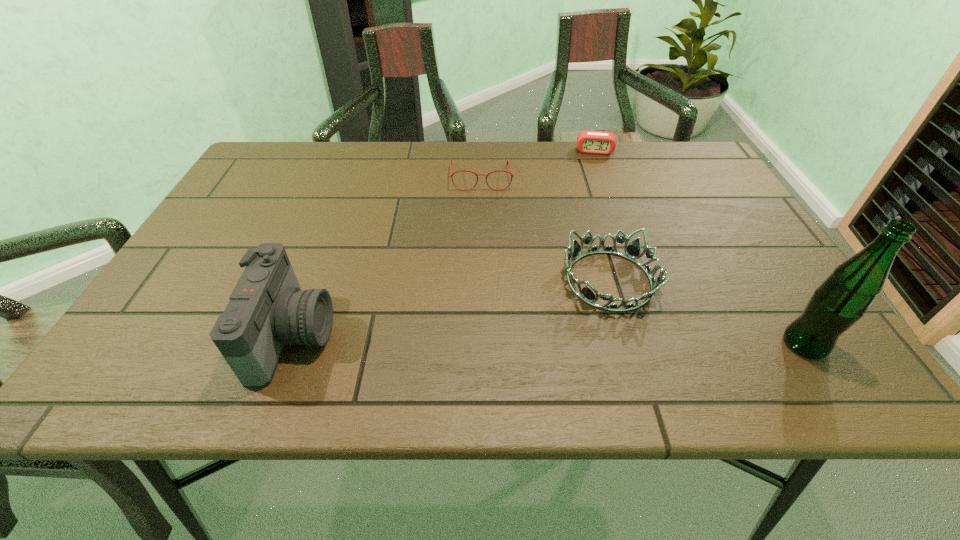
I want to click on free space between the beer bottle and the fourth object from right to left, so click(642, 260).

At what (x,y) coordinates should I click in order to perform the action: click on vacant area that lies between the camera and the tallest object. Please return your answer as a coordinate pair (x, y). The height and width of the screenshot is (540, 960). Looking at the image, I should click on (549, 340).

You are a GUI agent. You are given a task and a screenshot of the screen. Output one action in this format:
    pyautogui.click(x=<x>, y=<y>)
    Task: Click on the free area in between the second object from left to right and the beer bottle
    This screenshot has height=540, width=960.
    Given the screenshot: What is the action you would take?
    pyautogui.click(x=642, y=260)

You are a GUI agent. You are given a task and a screenshot of the screen. Output one action in this format:
    pyautogui.click(x=<x>, y=<y>)
    Task: Click on the empty location between the second farthest object and the rightmost object
    The image size is (960, 540).
    Given the screenshot: What is the action you would take?
    click(x=642, y=260)

The height and width of the screenshot is (540, 960). Find the location of `vacant space that is in between the spectacles and the second tallest object`. vacant space that is in between the spectacles and the second tallest object is located at coordinates (387, 257).

Locate an element on the screen. This screenshot has height=540, width=960. unoccupied area between the farthest object and the third tallest object is located at coordinates (602, 215).

Where is `free area in between the spectacles and the third tallest object`? This screenshot has height=540, width=960. free area in between the spectacles and the third tallest object is located at coordinates (545, 229).

I want to click on vacant area that lies between the spectacles and the fourth shortest object, so click(x=387, y=257).

Identify which object is the nearest to the spectacles. Please provide its 2D coordinates. Your answer should be formatted as a tuple, i.e. [(x, y)], where the tuple contains the x and y coordinates of a point satisfying the conditions above.

[(591, 142)]

Select which object appears as the closest to the second farthest object. Please provide its 2D coordinates. Your answer should be formatted as a tuple, i.e. [(x, y)], where the tuple contains the x and y coordinates of a point satisfying the conditions above.

[(591, 142)]